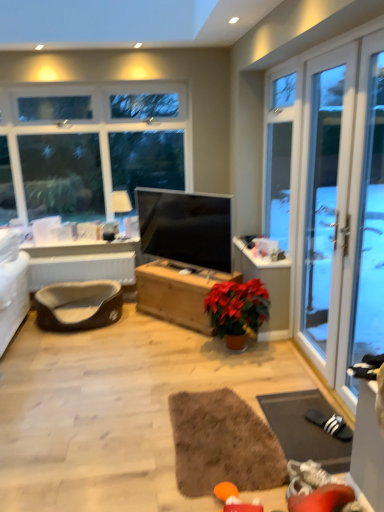
Identify the location of vacant space in front of brown plush pet bed at lower left. This screenshot has height=512, width=384. click(x=73, y=353).